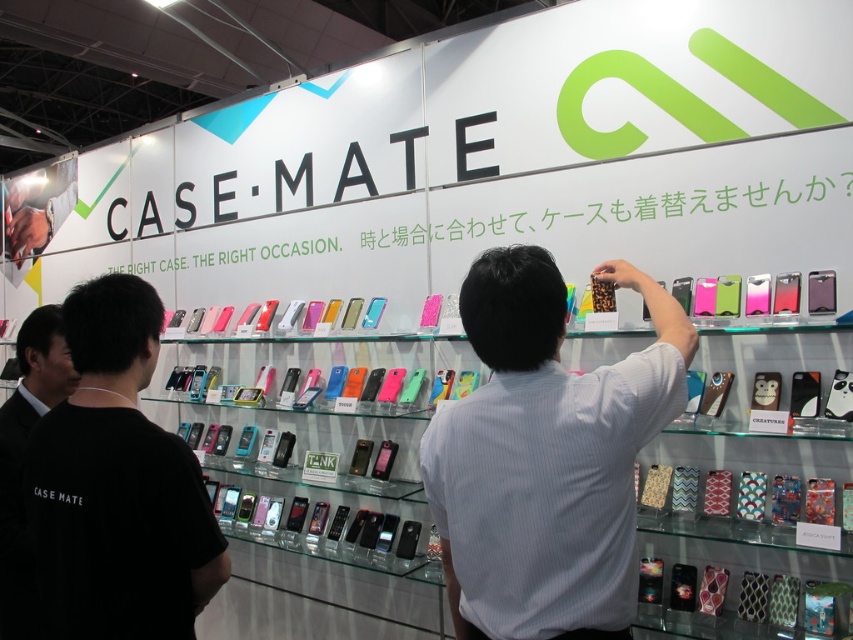
Who is lower down, leopard print case at upper center or black shirt at left?

black shirt at left is below.

The image size is (853, 640). In order to click on leopard print case at upper center in this screenshot , I will do `click(546, 456)`.

Identify the location of leopard print case at upper center. (546, 456).

Can you confirm if leopard print case at upper center is thinner than black t-shirt at left?

No.

At what (x,y) coordinates should I click in order to perform the action: click on leopard print case at upper center. Please return your answer as a coordinate pair (x, y). Looking at the image, I should click on (546, 456).

Who is positioned more to the right, black t-shirt at left or black shirt at left?

black t-shirt at left

Can you confirm if black t-shirt at left is positioned below black shirt at left?

Incorrect, black t-shirt at left is not positioned below black shirt at left.

Between point (163, 576) and point (15, 461), which one is positioned behind?

Point (15, 461)

This screenshot has height=640, width=853. I want to click on black t-shirt at left, so click(117, 484).